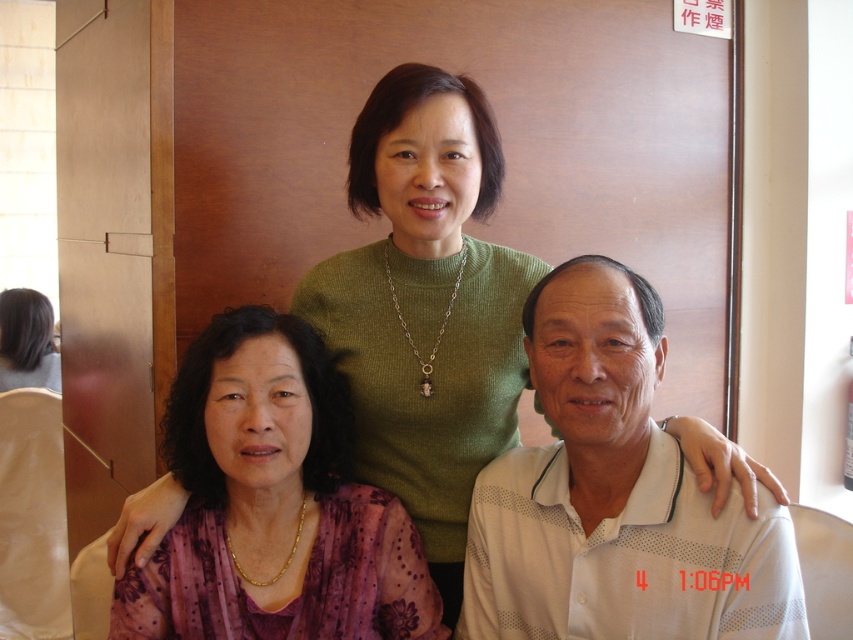
Who is lower down, white textured polo shirt at center or matte purple blouse at lower left?

white textured polo shirt at center is below.

Does white textured polo shirt at center have a larger size compared to matte purple blouse at lower left?

Yes.

You are a GUI agent. You are given a task and a screenshot of the screen. Output one action in this format:
    pyautogui.click(x=<x>, y=<y>)
    Task: Click on the white textured polo shirt at center
    Image resolution: width=853 pixels, height=640 pixels.
    Given the screenshot: What is the action you would take?
    pyautogui.click(x=614, y=497)

The height and width of the screenshot is (640, 853). I want to click on white textured polo shirt at center, so click(614, 497).

Is purple sheer blouse at center below matte purple blouse at lower left?

Indeed, purple sheer blouse at center is positioned under matte purple blouse at lower left.

Between purple sheer blouse at center and matte purple blouse at lower left, which one has more height?

purple sheer blouse at center

Who is more distant from viewer, (242, 506) or (39, 340)?

Positioned behind is point (39, 340).

This screenshot has height=640, width=853. In order to click on purple sheer blouse at center in this screenshot , I will do `click(276, 499)`.

Between matte green sweater at center and matte purple blouse at lower left, which one has more height?

matte green sweater at center is taller.

Is matte green sweater at center above matte purple blouse at lower left?

No, matte green sweater at center is not above matte purple blouse at lower left.

The width and height of the screenshot is (853, 640). What do you see at coordinates (427, 305) in the screenshot?
I see `matte green sweater at center` at bounding box center [427, 305].

Image resolution: width=853 pixels, height=640 pixels. What are the coordinates of `matte green sweater at center` in the screenshot? It's located at (427, 305).